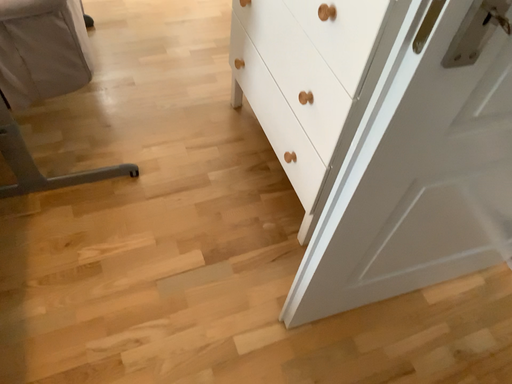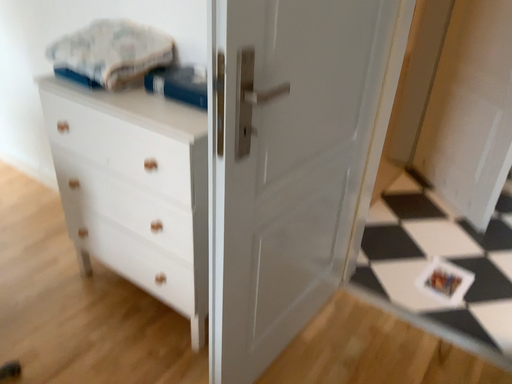
Question: Which way did the camera rotate in the video?

Choices:
 (A) rotated upward
 (B) rotated downward

Answer: (A)